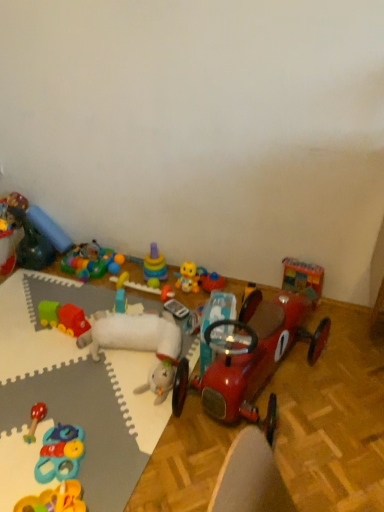
Locate an element on the screen. This screenshot has height=512, width=384. vacant space that is in between rubberized plastic toy at lower left, marked as the sixth toy in a right-to-left arrangement, and white plush lamb at lower left, the fifth toy positioned from the right is located at coordinates (99, 407).